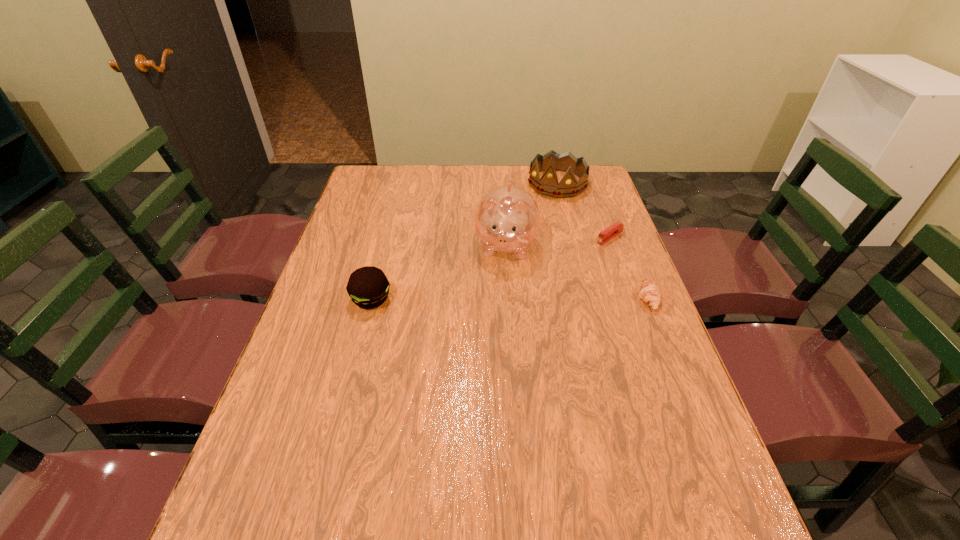
You are a GUI agent. You are given a task and a screenshot of the screen. Output one action in this format:
    pyautogui.click(x=<x>, y=<y>)
    Task: Click on the leftmost object
    Image resolution: width=960 pixels, height=540 pixels.
    Given the screenshot: What is the action you would take?
    pyautogui.click(x=368, y=287)

Where is `patty`? patty is located at coordinates (368, 287).

Find the location of a particular element. Image resolution: width=960 pixels, height=540 pixels. pastry is located at coordinates (649, 292).

You are a GUI agent. You are given a task and a screenshot of the screen. Output one action in this format:
    pyautogui.click(x=<x>, y=<y>)
    Task: Click on the stapler
    
    Given the screenshot: What is the action you would take?
    pyautogui.click(x=616, y=228)

This screenshot has width=960, height=540. What are the coordinates of `the second tallest object` in the screenshot? It's located at (548, 185).

Locate an element on the screen. tiara is located at coordinates (548, 185).

Locate an element on the screen. The image size is (960, 540). piggy bank is located at coordinates tap(507, 219).

Image resolution: width=960 pixels, height=540 pixels. I want to click on vacant space situated on the right of the leftmost object, so click(428, 299).

The width and height of the screenshot is (960, 540). Find the location of `vacant space located on the front-facing side of the pastry`. vacant space located on the front-facing side of the pastry is located at coordinates (531, 299).

The width and height of the screenshot is (960, 540). In order to click on vacant space located 0.280m on the front-facing side of the pastry in this screenshot , I will do `click(535, 299)`.